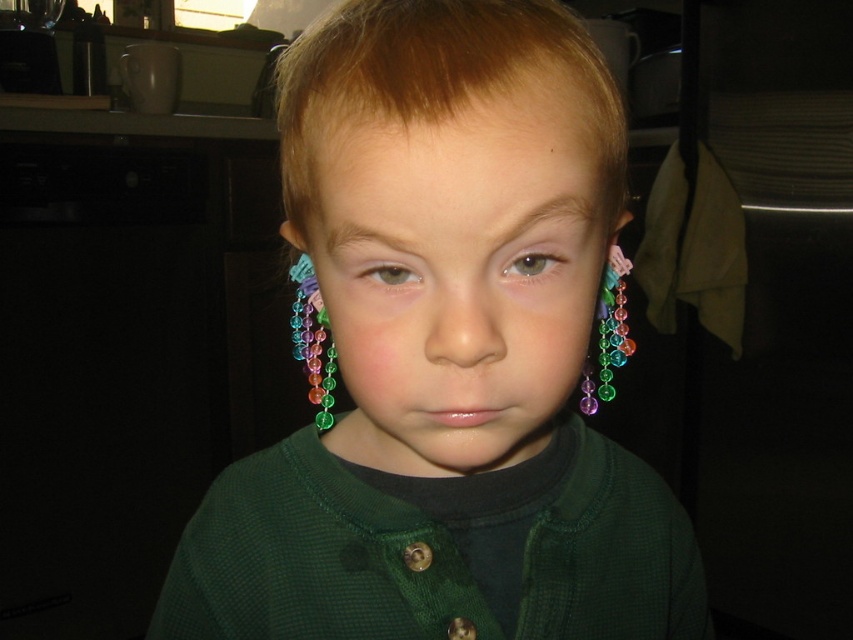
You are standing in the kitchen area and want to move from the point at coordinates point [318,355] to the point at coordinates point [370,269]. Can you walk directly from the first point to the second without passing through any objects?

Point [318,355] is behind point [370,269], so you cannot walk directly from the first point to the second without passing through any objects.

From the picture: You are a photographer setting up a shoot in a dimly lit room. You notice the beaded earrings at left and the green matte eye at center. Which object is closer to the camera?

The beaded earrings at left are closer to the camera because the green matte eye at center is positioned behind them.

You are a tailor measuring the distance between the green fabric shirt at center and the gray matte eye at center for a custom fitting. The minimum required space for proper adjustment is 5 inches. Can you proceed with the current measurement?

The distance between the green fabric shirt at center and the gray matte eye at center is 4.85 inches, which is less than the required 5 inches. Therefore, you cannot proceed with the current measurement and need to adjust for more space.